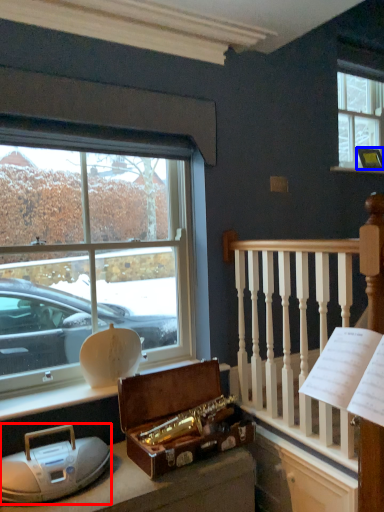
Question: Which of the following is the closest to the observer, artifact (highlighted by a red box) or picture frame (highlighted by a blue box)?

Choices:
 (A) artifact
 (B) picture frame

Answer: (A)